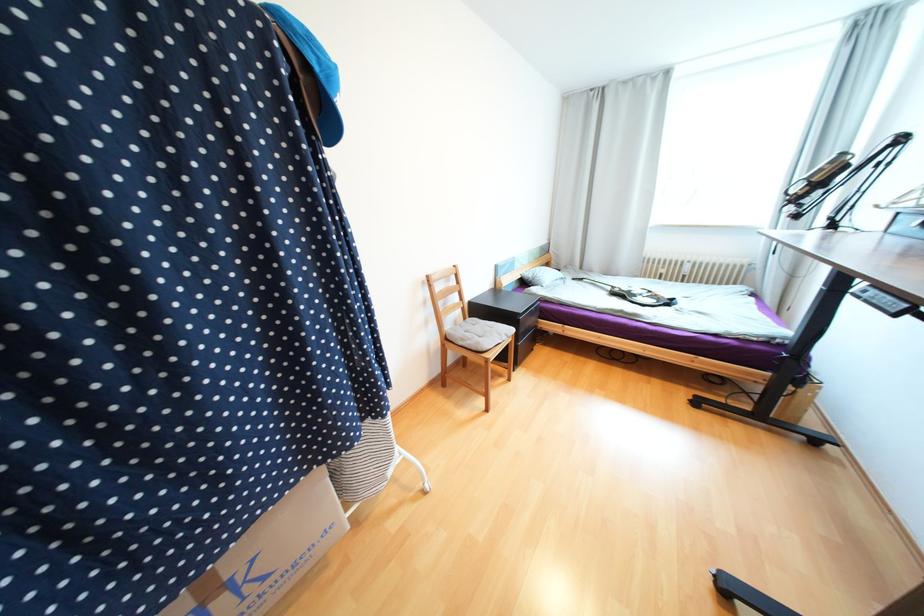
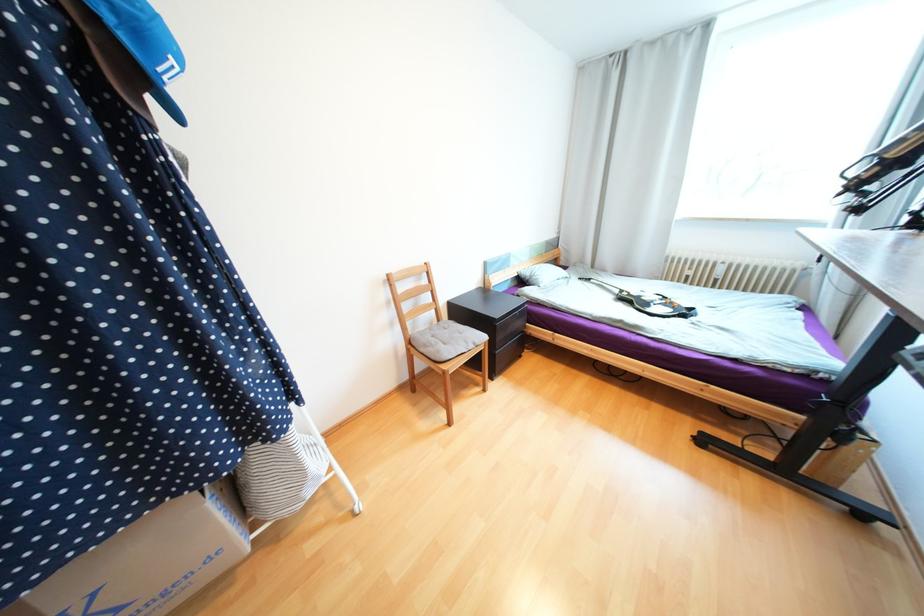
The point at (505, 334) is marked in the first image. Where is the corresponding point in the second image?

(472, 342)